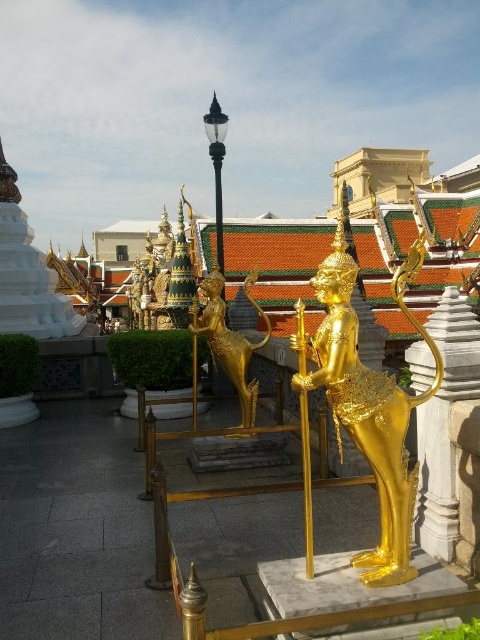
Which of these two, white stone pillar at right or gold metallic statue at center, stands taller?

gold metallic statue at center

Between white stone pillar at right and gold metallic statue at center, which one is positioned higher?

gold metallic statue at center is higher up.

Is point (444, 289) closer to camera compared to point (223, 349)?

No.

I want to click on white stone pillar at right, so click(444, 422).

Image resolution: width=480 pixels, height=640 pixels. Describe the element at coordinates (370, 404) in the screenshot. I see `gold polished statue at center` at that location.

Is gold polished statue at center to the right of white stone pillar at right from the viewer's perspective?

Yes, gold polished statue at center is to the right of white stone pillar at right.

What are the coordinates of `gold polished statue at center` in the screenshot? It's located at (370, 404).

Can you confirm if gold polished statue at center is positioned to the right of gold metallic statue at center?

Yes, gold polished statue at center is to the right of gold metallic statue at center.

Is gold polished statue at center to the left of gold metallic statue at center from the viewer's perspective?

No, gold polished statue at center is not to the left of gold metallic statue at center.

Between point (330, 253) and point (223, 333), which one is positioned behind?

The point (330, 253) is behind.

Locate an element on the screen. This screenshot has height=640, width=480. gold polished statue at center is located at coordinates (370, 404).